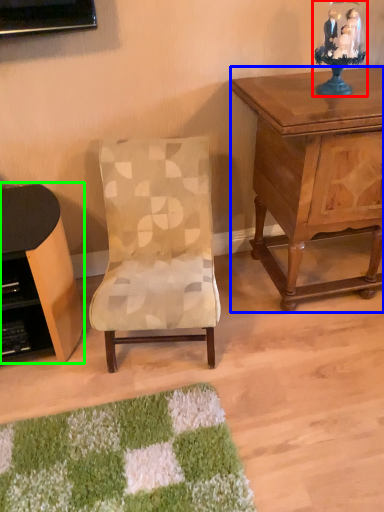
Question: Based on their relative distances, which object is farther from table lamp (highlighted by a red box)? Choose from nightstand (highlighted by a blue box) and desk (highlighted by a green box).

Choices:
 (A) nightstand
 (B) desk

Answer: (B)